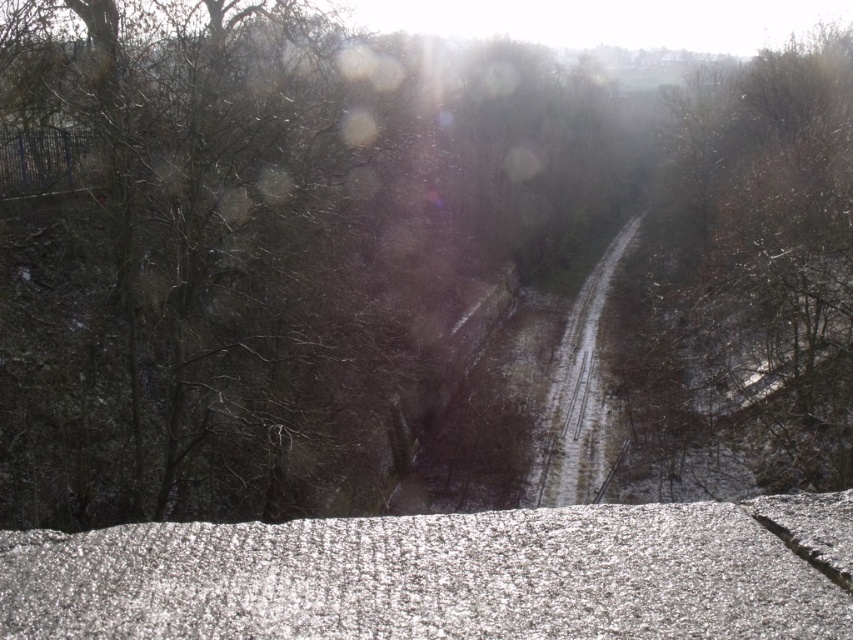
You are standing on the stone ledge in the scene. A brown leafless tree at right is located at point (747, 280). If you want to walk towards the tree, which direction should you move relative to your current position?

To walk towards the brown leafless tree at right located at point (747, 280), you should move to the right since the tree is positioned at the right side of the scene.